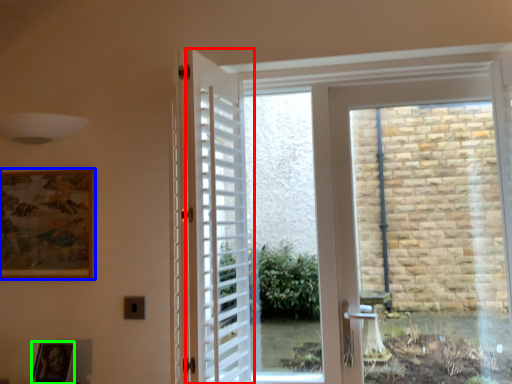
Question: Based on their relative distances, which object is farther from door (highlighted by a red box)? Choose from picture frame (highlighted by a blue box) and picture frame (highlighted by a green box).

Choices:
 (A) picture frame
 (B) picture frame

Answer: (B)